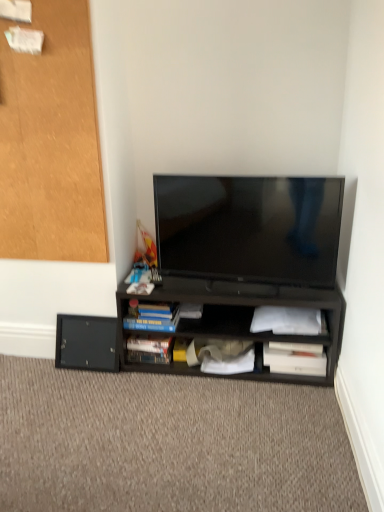
In order to click on free space in front of white paper at lower right, which is the first paperback book in right-to-left order in this screenshot , I will do `click(296, 393)`.